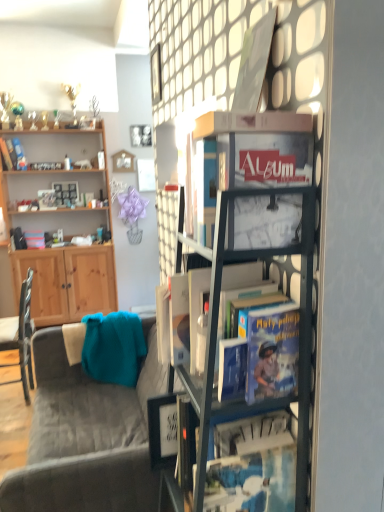
Question: From a real-world perspective, is wooden cabinet at left physically below velvet grey couch at lower left?

Choices:
 (A) no
 (B) yes

Answer: (A)

Question: Is wooden cabinet at left surrounding velvet grey couch at lower left?

Choices:
 (A) no
 (B) yes

Answer: (A)

Question: Can you confirm if wooden cabinet at left is positioned to the right of velvet grey couch at lower left?

Choices:
 (A) no
 (B) yes

Answer: (A)

Question: From the image's perspective, does wooden cabinet at left appear higher than velvet grey couch at lower left?

Choices:
 (A) no
 (B) yes

Answer: (B)

Question: Is wooden cabinet at left shorter than velvet grey couch at lower left?

Choices:
 (A) yes
 (B) no

Answer: (B)

Question: In terms of size, does wooden cabinet at left appear bigger or smaller than metallic silver picture frame at upper center, which appears as the fourth picture frame when viewed from the back?

Choices:
 (A) small
 (B) big

Answer: (B)

Question: In the image, is wooden cabinet at left on the left side or the right side of metallic silver picture frame at upper center, which appears as the fourth picture frame when viewed from the back?

Choices:
 (A) left
 (B) right

Answer: (A)

Question: Would you say wooden cabinet at left is inside or outside metallic silver picture frame at upper center, arranged as the second picture frame when viewed from the right?

Choices:
 (A) inside
 (B) outside

Answer: (B)

Question: From a real-world perspective, is wooden cabinet at left positioned above or below metallic silver picture frame at upper center, the second picture frame from the front?

Choices:
 (A) above
 (B) below

Answer: (B)

Question: In terms of height, does wooden cabinet at left look taller or shorter compared to hardcover book at center, marked as the 2th book in a left-to-right arrangement?

Choices:
 (A) tall
 (B) short

Answer: (A)

Question: From a real-world perspective, relative to hardcover book at center, marked as the 2th book in a left-to-right arrangement, is wooden cabinet at left vertically above or below?

Choices:
 (A) below
 (B) above

Answer: (A)

Question: Based on their sizes in the image, would you say wooden cabinet at left is bigger or smaller than hardcover book at center, arranged as the first book when ordered from the bottom?

Choices:
 (A) small
 (B) big

Answer: (B)

Question: In the image, is wooden cabinet at left positioned in front of or behind hardcover book at center, placed as the 1th book when sorted from front to back?

Choices:
 (A) front
 (B) behind

Answer: (B)

Question: In the image, is metallic silver picture frame at upper center, which is counted as the third picture frame, starting from the front, positioned in front of or behind wooden cabinet at left?

Choices:
 (A) behind
 (B) front

Answer: (A)

Question: Does point (129, 161) appear closer or farther from the camera than point (64, 293)?

Choices:
 (A) farther
 (B) closer

Answer: (A)